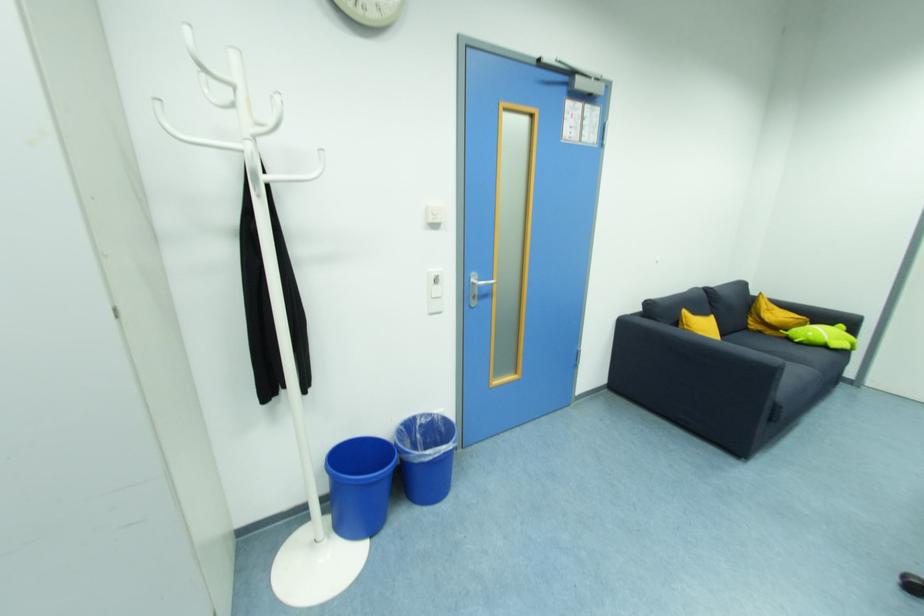
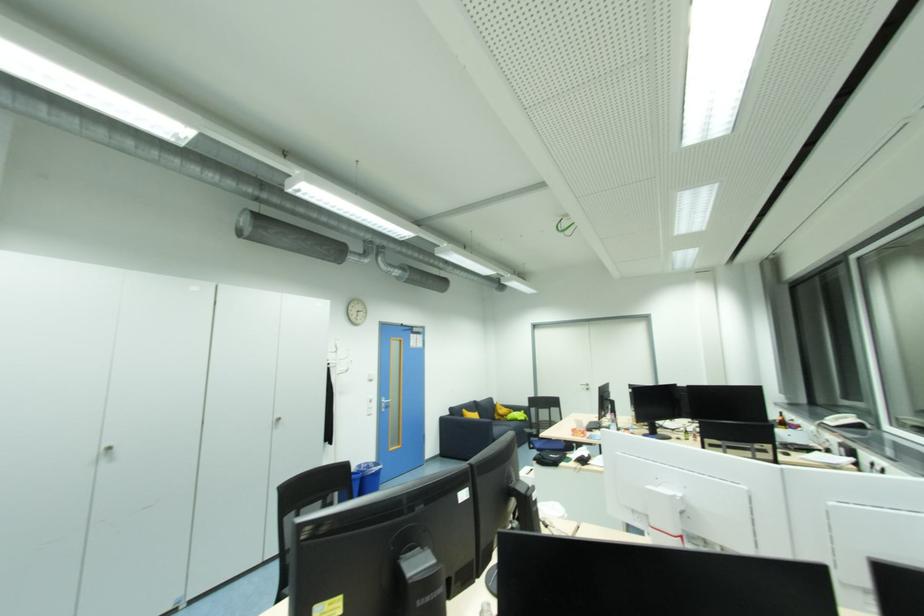
Where in the second image is the point corresponding to pixel 678 323 from the first image?

(466, 416)